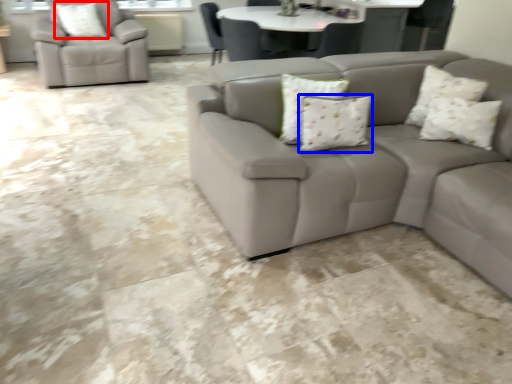
Question: Which point is closer to the camera, pillow (highlighted by a red box) or pillow (highlighted by a blue box)?

Choices:
 (A) pillow
 (B) pillow

Answer: (B)